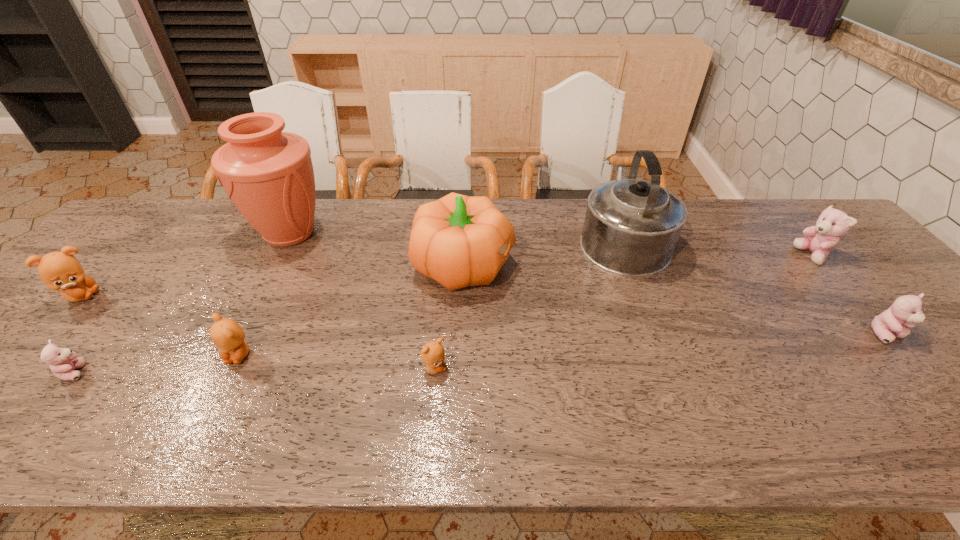
Locate an element on the screen. Image resolution: width=960 pixels, height=540 pixels. terracotta vase is located at coordinates (268, 174).

This screenshot has height=540, width=960. Identify the location of vase. (268, 174).

The width and height of the screenshot is (960, 540). Identify the location of kettle. (631, 227).

Locate an element on the screen. The height and width of the screenshot is (540, 960). the eighth shortest object is located at coordinates (631, 227).

Where is `the third tallest object`? Image resolution: width=960 pixels, height=540 pixels. the third tallest object is located at coordinates (458, 241).

This screenshot has height=540, width=960. Find the location of `the farthest pink teddy bear`. the farthest pink teddy bear is located at coordinates (832, 223).

The image size is (960, 540). What are the coordinates of `the farthest teddy bear` in the screenshot? It's located at (832, 223).

Where is `the leftmost brown teddy bear`? the leftmost brown teddy bear is located at coordinates (61, 271).

Identify the location of the farthest brown teddy bear. (61, 271).

This screenshot has width=960, height=540. Find the location of `the second biggest brown teddy bear`. the second biggest brown teddy bear is located at coordinates (227, 335).